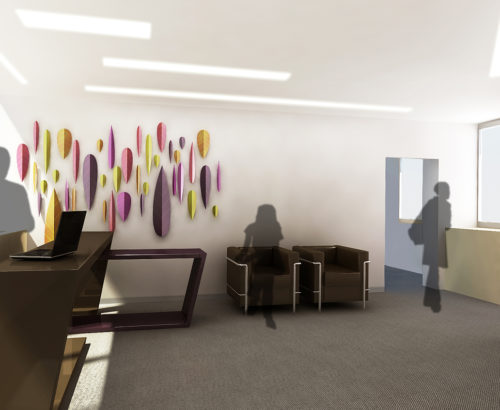
At what (x,y) coordinates should I click in order to perform the action: click on shadow image of doorway. Please return your answer as a coordinate pair (x, y). Image resolution: width=500 pixels, height=410 pixels. Looking at the image, I should click on (396, 229).